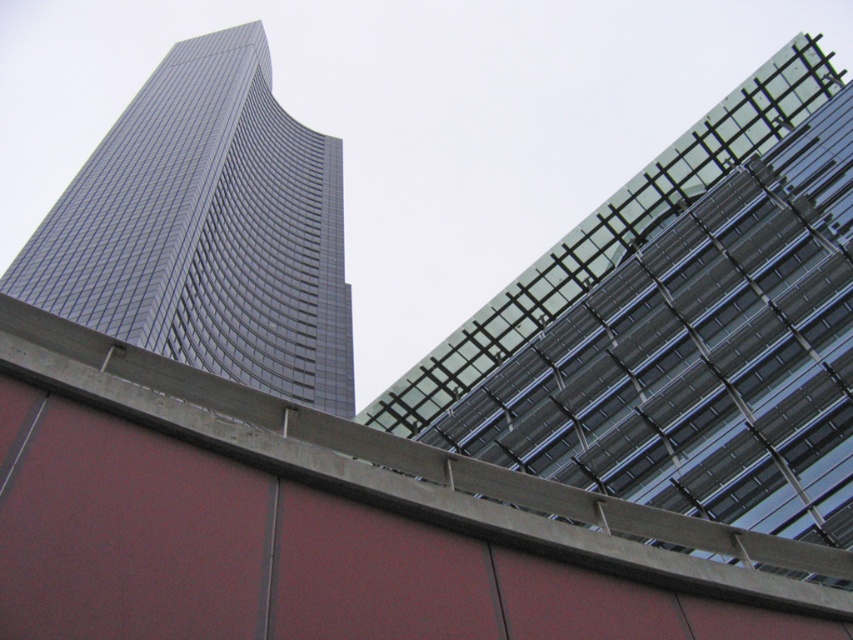
Between transparent glass building at upper right and shiny glass skyscraper at left, which one appears on the right side from the viewer's perspective?

Positioned to the right is transparent glass building at upper right.

Does transparent glass building at upper right come behind shiny glass skyscraper at left?

No, transparent glass building at upper right is in front of shiny glass skyscraper at left.

Image resolution: width=853 pixels, height=640 pixels. What do you see at coordinates (682, 326) in the screenshot?
I see `transparent glass building at upper right` at bounding box center [682, 326].

In order to click on transparent glass building at upper right in this screenshot , I will do `click(682, 326)`.